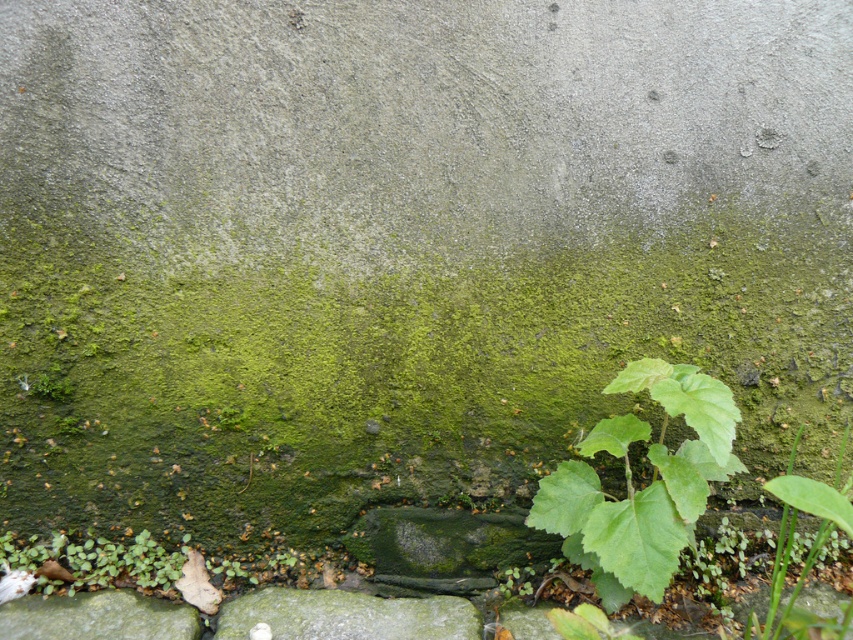
Question: Among these points, which one is farthest from the camera?

Choices:
 (A) (608, 22)
 (B) (9, 609)
 (C) (225, 604)

Answer: (C)

Question: Which point is closer to the camera?

Choices:
 (A) green mossy concrete at lower center
 (B) gray stone at lower center
 (C) green leafy plant at lower right

Answer: (C)

Question: From the image, what is the correct spatial relationship of green leafy plant at lower right in relation to gray stone at lower center?

Choices:
 (A) above
 (B) below

Answer: (A)

Question: Is green leafy plant at lower right thinner than gray stone at lower center?

Choices:
 (A) yes
 (B) no

Answer: (A)

Question: Does green mossy concrete at lower center appear on the left side of gray stone at lower center?

Choices:
 (A) yes
 (B) no

Answer: (B)

Question: Which of these objects is positioned farthest from the gray stone at lower center?

Choices:
 (A) green mossy concrete at lower center
 (B) green mossy rock at lower left
 (C) green leafy plant at lower right

Answer: (A)